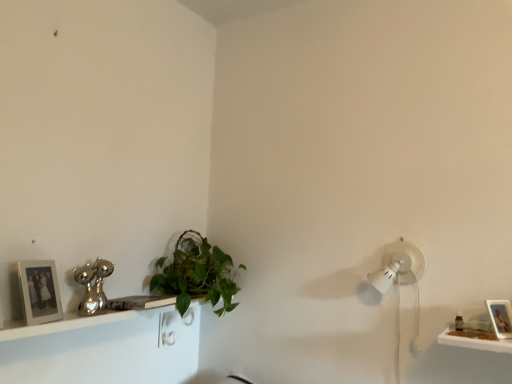
Question: From their relative heights in the image, would you say white matte picture frame at left, which is the 2th picture frame from right to left, is taller or shorter than white glossy shelf at lower left?

Choices:
 (A) tall
 (B) short

Answer: (B)

Question: Is white matte picture frame at left, which is the 2th picture frame from right to left, situated inside white glossy shelf at lower left or outside?

Choices:
 (A) outside
 (B) inside

Answer: (A)

Question: Estimate the real-world distances between objects in this image. Which object is farther from the wooden photo frame at lower right, which is counted as the 1th picture frame, starting from the right?

Choices:
 (A) white glossy shelf at lower left
 (B) white matte picture frame at left, which ranks as the 1th picture frame in left-to-right order
 (C) green leafy plant at center

Answer: (B)

Question: Which is farther from the white matte picture frame at left, which ranks as the 1th picture frame in left-to-right order?

Choices:
 (A) white glossy shelf at lower left
 (B) green leafy plant at center
 (C) wooden photo frame at lower right, the second picture frame in the left-to-right sequence

Answer: (C)